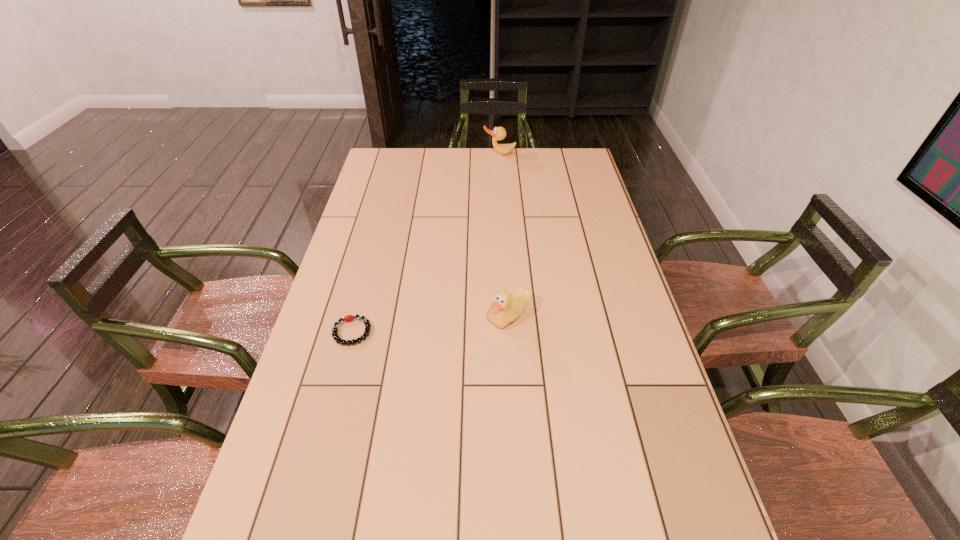
This screenshot has width=960, height=540. What are the coordinates of `empty space between the farthest object and the shortest object` in the screenshot? It's located at (426, 242).

I want to click on vacant space that's between the farther duck and the leftmost object, so click(426, 242).

Find the location of `unoccupied position between the nearer duck and the farther duck`. unoccupied position between the nearer duck and the farther duck is located at coordinates (504, 235).

At what (x,y) coordinates should I click in order to perform the action: click on unoccupied position between the farther duck and the leftmost object. Please return your answer as a coordinate pair (x, y). Image resolution: width=960 pixels, height=540 pixels. Looking at the image, I should click on [x=426, y=242].

Point out which object is positioned as the second nearest to the shortest object. Please provide its 2D coordinates. Your answer should be formatted as a tuple, i.e. [(x, y)], where the tuple contains the x and y coordinates of a point satisfying the conditions above.

[(499, 133)]

Identify which object is the closest to the farthest object. Please provide its 2D coordinates. Your answer should be formatted as a tuple, i.e. [(x, y)], where the tuple contains the x and y coordinates of a point satisfying the conditions above.

[(507, 307)]

Find the location of a particular element. The width and height of the screenshot is (960, 540). vacant space that satisfies the following two spatial constraints: 1. on the beak of the farthest object; 2. at the beak of the nearer duck is located at coordinates (510, 316).

Where is `blank area in the image that satisfies the following two spatial constraints: 1. on the beak of the farthest object; 2. at the beak of the nearer duck`? The width and height of the screenshot is (960, 540). blank area in the image that satisfies the following two spatial constraints: 1. on the beak of the farthest object; 2. at the beak of the nearer duck is located at coordinates (510, 316).

Where is `free spot that satisfies the following two spatial constraints: 1. on the beak of the farther duck; 2. at the beak of the nearer duck`? The image size is (960, 540). free spot that satisfies the following two spatial constraints: 1. on the beak of the farther duck; 2. at the beak of the nearer duck is located at coordinates 510,316.

Locate an element on the screen. This screenshot has height=540, width=960. vacant point that satisfies the following two spatial constraints: 1. on the beak of the farther duck; 2. at the beak of the nearer duck is located at coordinates click(510, 316).